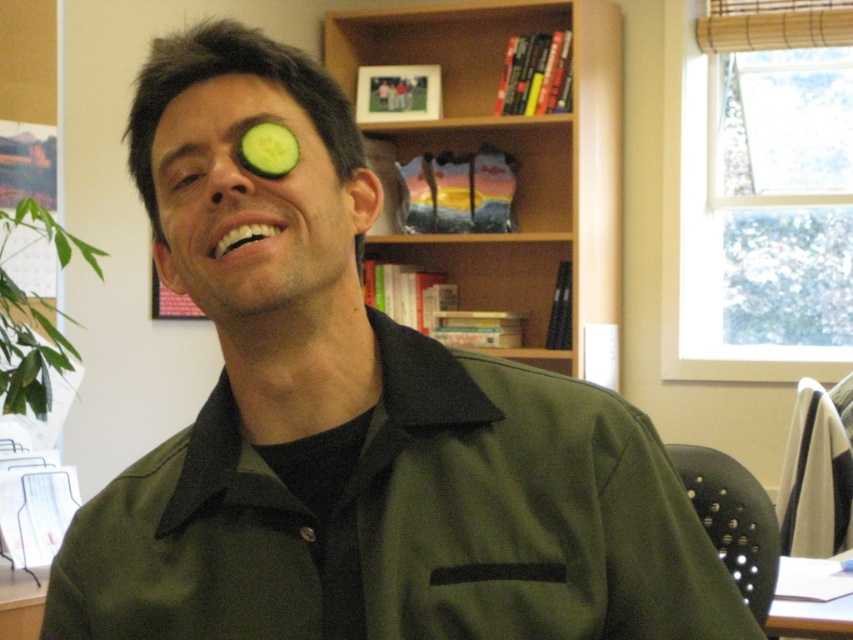
Question: Based on their relative distances, which object is nearer to the green matte cucumber at upper left?

Choices:
 (A) wooden bookshelf at upper center
 (B) green matte cucumber at left

Answer: (B)

Question: Does wooden bookshelf at upper center have a smaller size compared to green matte cucumber at left?

Choices:
 (A) yes
 (B) no

Answer: (B)

Question: Can you confirm if wooden bookshelf at upper center is smaller than green smooth cucumber at left?

Choices:
 (A) no
 (B) yes

Answer: (A)

Question: Among these objects, which one is farthest from the camera?

Choices:
 (A) green matte cucumber at upper left
 (B) green matte cucumber at left
 (C) wooden bookshelf at upper center

Answer: (C)

Question: Can you confirm if green matte cucumber at upper left is thinner than green matte cucumber at left?

Choices:
 (A) yes
 (B) no

Answer: (B)

Question: Which point appears closest to the camera in this image?

Choices:
 (A) (177, 182)
 (B) (520, 236)
 (C) (294, 145)

Answer: (C)